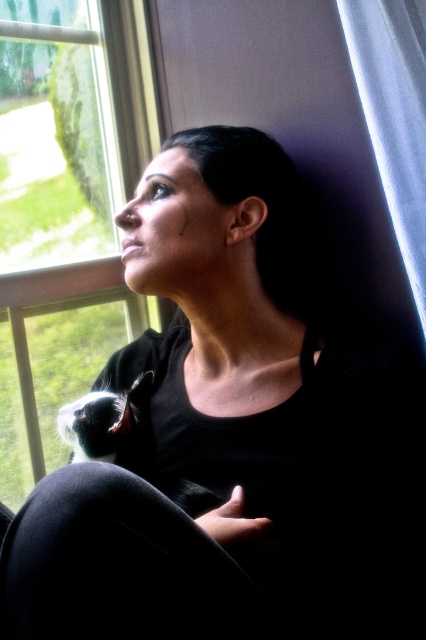
Can you confirm if transparent glass window at upper left is smaller than white sheer curtain at upper right?

No, transparent glass window at upper left is not smaller than white sheer curtain at upper right.

Is transparent glass window at upper left taller than white sheer curtain at upper right?

Indeed, transparent glass window at upper left has a greater height compared to white sheer curtain at upper right.

The image size is (426, 640). I want to click on transparent glass window at upper left, so click(x=66, y=211).